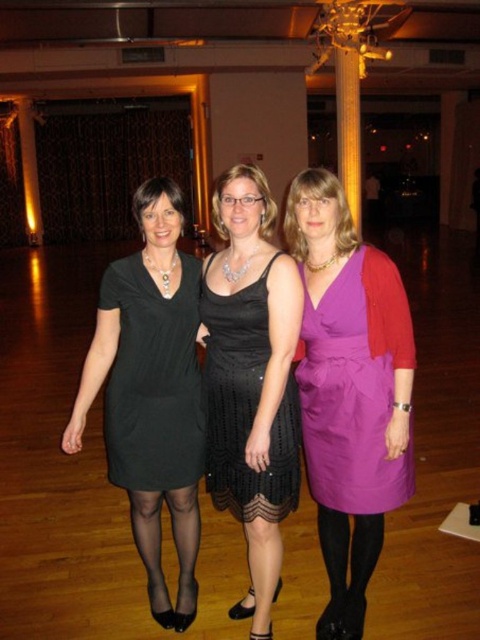
Can you confirm if purple satin dress at center is positioned below black matte dress at left?

Indeed, purple satin dress at center is positioned under black matte dress at left.

Locate an element on the screen. The height and width of the screenshot is (640, 480). purple satin dress at center is located at coordinates (348, 388).

Describe the element at coordinates (348, 388) in the screenshot. I see `purple satin dress at center` at that location.

Locate an element on the screen. purple satin dress at center is located at coordinates (348, 388).

Is purple satin dress at center to the left of matte black dress at center from the viewer's perspective?

In fact, purple satin dress at center is to the right of matte black dress at center.

Does purple satin dress at center come behind matte black dress at center?

No, it is in front of matte black dress at center.

This screenshot has height=640, width=480. Describe the element at coordinates (348, 388) in the screenshot. I see `purple satin dress at center` at that location.

At what (x,y) coordinates should I click in order to perform the action: click on purple satin dress at center. Please return your answer as a coordinate pair (x, y). Image resolution: width=480 pixels, height=640 pixels. Looking at the image, I should click on (348, 388).

Is black matte dress at left bigger than black sequined dress at center?

Incorrect, black matte dress at left is not larger than black sequined dress at center.

Who is more forward, (190,298) or (236,472)?

Point (236,472)

What do you see at coordinates (153, 380) in the screenshot?
I see `black matte dress at left` at bounding box center [153, 380].

Where is `black matte dress at left`? black matte dress at left is located at coordinates (153, 380).